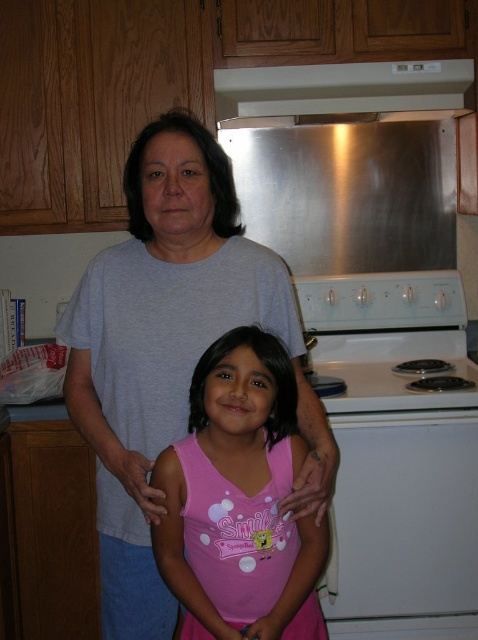
Is point (279, 497) farther from viewer compared to point (456, 608)?

No, (279, 497) is in front of (456, 608).

Which is in front, point (243, 588) or point (361, 612)?

Positioned in front is point (243, 588).

This screenshot has height=640, width=478. Describe the element at coordinates (239, 499) in the screenshot. I see `pink fabric shirt at center` at that location.

Image resolution: width=478 pixels, height=640 pixels. I want to click on pink fabric shirt at center, so click(239, 499).

Can you confirm if gray cotton shirt at upper center is smaller than white glossy stove at lower right?

Actually, gray cotton shirt at upper center might be larger than white glossy stove at lower right.

At what (x,y) coordinates should I click in order to perform the action: click on gray cotton shirt at upper center. Please return your answer as a coordinate pair (x, y). This screenshot has height=640, width=478. Looking at the image, I should click on (171, 352).

The height and width of the screenshot is (640, 478). In order to click on gray cotton shirt at upper center in this screenshot , I will do `click(171, 352)`.

What do you see at coordinates (405, 524) in the screenshot? The height and width of the screenshot is (640, 478). I see `white glossy oven at lower right` at bounding box center [405, 524].

Which is more to the right, white glossy oven at lower right or stainless steel exhaust hood at upper center?

white glossy oven at lower right

Is point (412, 490) farther from camera compared to point (269, 81)?

No, it is not.

Identify the location of white glossy oven at lower right. (405, 524).